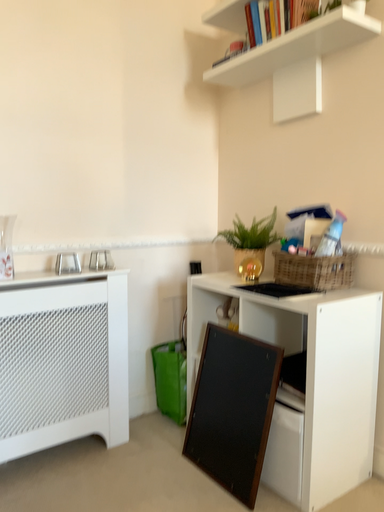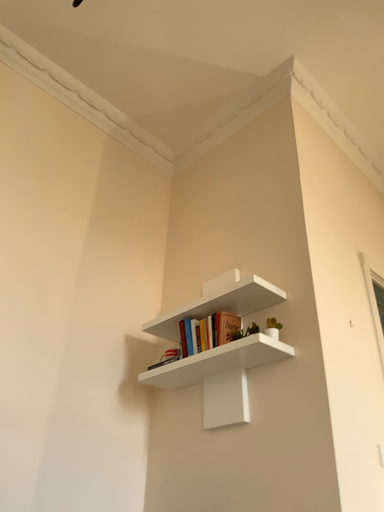
Question: How did the camera likely rotate when shooting the video?

Choices:
 (A) rotated right
 (B) rotated left

Answer: (A)